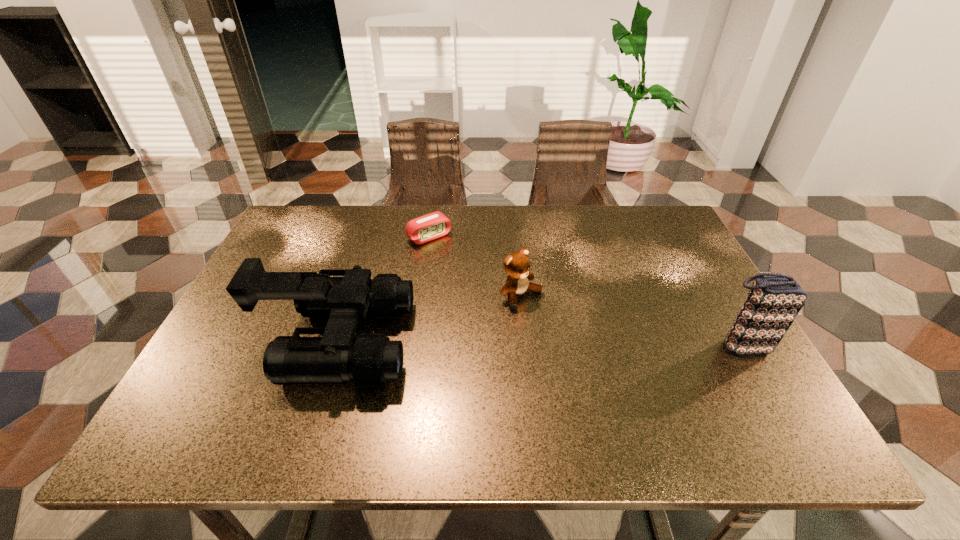
Where is `binoculars`? binoculars is located at coordinates (371, 360).

Locate an element on the screen. clutch bag is located at coordinates (774, 300).

The image size is (960, 540). Find the location of `the shortest object`. the shortest object is located at coordinates (434, 225).

This screenshot has height=540, width=960. I want to click on alarm clock, so click(x=434, y=225).

Find the location of a particular element. the third object from left to right is located at coordinates (517, 265).

Locate an element on the screen. This screenshot has width=960, height=540. teddy bear is located at coordinates pos(517,265).

The height and width of the screenshot is (540, 960). In order to click on vacant region located 0.280m on the front lenses of the binoculars in this screenshot , I will do click(529, 341).

Locate an element on the screen. vacant space located on the front-facing side of the shortest object is located at coordinates (520, 324).

The width and height of the screenshot is (960, 540). What are the coordinates of `vacant position located 0.250m on the front-facing side of the shortest object` in the screenshot? It's located at pyautogui.click(x=490, y=294).

This screenshot has height=540, width=960. I want to click on free point located 0.100m on the front-facing side of the shortest object, so click(459, 264).